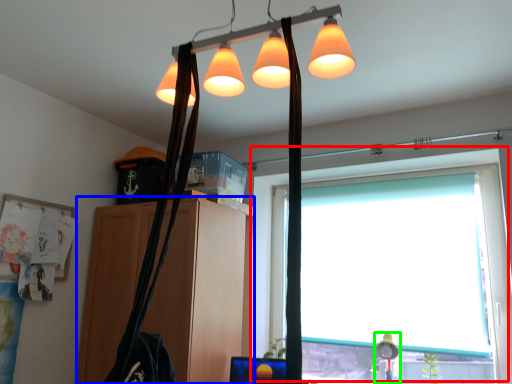
Question: Which object is positioned closest to window (highlighted by a red box)? Select from cabinetry (highlighted by a blue box) and table lamp (highlighted by a green box).

Choices:
 (A) cabinetry
 (B) table lamp

Answer: (A)